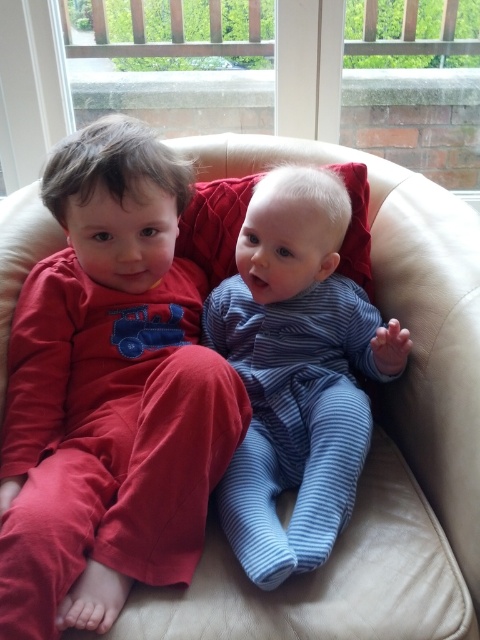
You are taking a photo of the two children sitting on the armchair. You want to focus on the point that is closer to you. Which point should you choose between point (133, 173) and point (285, 488)?

Point (133, 173) is closer to the viewer than point (285, 488), so you should choose point (133, 173) to focus on the closer point.

You are a photographer setting up for a family photo. You see the matte red pajamas at left and the blue striped onesie at center in the scene. Which child is positioned closer to the left side of the frame?

The matte red pajamas at left is positioned to the left of the blue striped onesie at center, so the child wearing the matte red pajamas at left is closer to the left side of the frame.